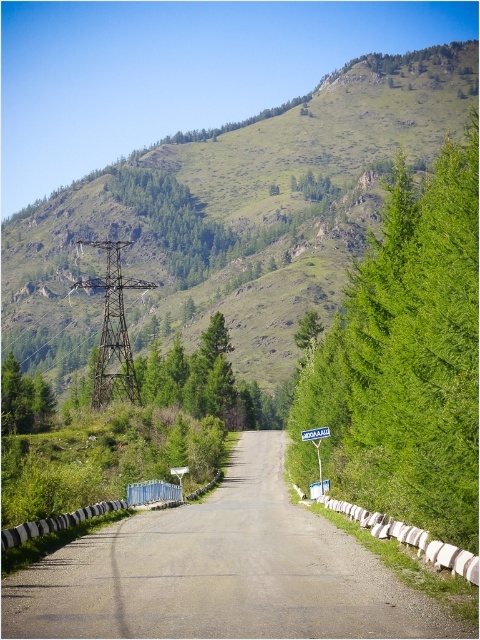
You are a hiker planning to take a photo of the green grassy mountain at upper center and the green leafy tree at right. Which object should you focus on first if you want to capture both in a single frame without moving the camera?

The green grassy mountain at upper center is wider than the green leafy tree at right, so you should focus on the green grassy mountain at upper center first to ensure it fits within the frame.

You are standing at the camera position and want to walk to the green leafy tree at right. If your walking speed is 1.5 meters per second, how many seconds will it take you to reach the tree?

The distance between you and the green leafy tree at right is 22.73 meters. At a speed of 1.5 meters per second, dividing the distance by the speed gives approximately 15.15 seconds. Therefore, it will take about 15 seconds to reach the tree.

You are driving a large truck that is 3 meters wide. You need to navigate through the gray asphalt road at center while avoiding obstacles. Considering the green leafy tree at right, will your truck fit on the road without hitting the tree?

The green leafy tree at right is bigger than the gray asphalt road at center, so the truck may not fit safely. The tree might block part of the road, making it too narrow for the truck to pass without hitting it.